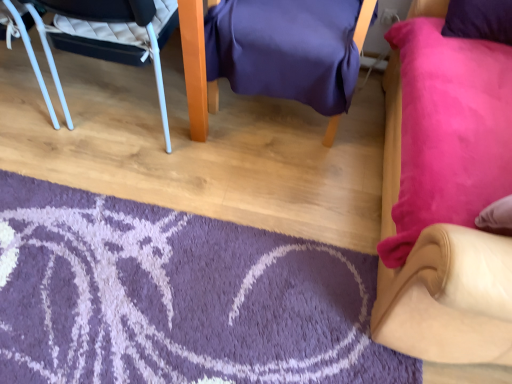
The height and width of the screenshot is (384, 512). Describe the element at coordinates (176, 297) in the screenshot. I see `purple shaggy rug at lower left` at that location.

What do you see at coordinates (196, 69) in the screenshot?
I see `purple fabric chair at center, placed as the second chair when sorted from left to right` at bounding box center [196, 69].

What are the coordinates of `suede-like beige chair at lower right, the first chair in the right-to-left sequence` in the screenshot? It's located at (449, 298).

This screenshot has height=384, width=512. I want to click on white plastic chair at left, the 1th chair in the left-to-right sequence, so click(x=119, y=22).

This screenshot has height=384, width=512. Identify the location of purple shaggy rug at lower left. (176, 297).

Is suede-like beige chair at lower right, the first chair in the right-to-left sequence, far away from purple fabric chair at center, placed as the second chair when sorted from left to right?

No, there isn't a large distance between suede-like beige chair at lower right, the first chair in the right-to-left sequence, and purple fabric chair at center, placed as the second chair when sorted from left to right.

Is suede-like beige chair at lower right, the third chair when ordered from left to right, to the right of purple fabric chair at center, which is the 2th chair in right-to-left order, from the viewer's perspective?

Indeed, suede-like beige chair at lower right, the third chair when ordered from left to right, is positioned on the right side of purple fabric chair at center, which is the 2th chair in right-to-left order.

Considering the points (391, 226) and (204, 110), which point is in front, point (391, 226) or point (204, 110)?

Point (391, 226)

Would you say suede-like beige chair at lower right, the third chair when ordered from left to right, is inside or outside purple fabric chair at center, placed as the second chair when sorted from left to right?

suede-like beige chair at lower right, the third chair when ordered from left to right, exists outside the volume of purple fabric chair at center, placed as the second chair when sorted from left to right.

How different are the orientations of white plastic chair at left, the 1th chair in the left-to-right sequence, and purple shaggy rug at lower left in degrees?

The angle between the facing direction of white plastic chair at left, the 1th chair in the left-to-right sequence, and the facing direction of purple shaggy rug at lower left is 0.279 degrees.

Is white plastic chair at left, which is the 3th chair in right-to-left order, facing towards purple shaggy rug at lower left?

No, white plastic chair at left, which is the 3th chair in right-to-left order, is not turned towards purple shaggy rug at lower left.

Can you confirm if white plastic chair at left, which is the 3th chair in right-to-left order, is positioned to the left of purple shaggy rug at lower left?

Yes.

Does white plastic chair at left, the 1th chair in the left-to-right sequence, have a smaller size compared to purple shaggy rug at lower left?

No.

Is purple shaggy rug at lower left next to white plastic chair at left, the 1th chair in the left-to-right sequence, and touching it?

No, purple shaggy rug at lower left is not beside white plastic chair at left, the 1th chair in the left-to-right sequence.

Between purple shaggy rug at lower left and white plastic chair at left, which is the 3th chair in right-to-left order, which one has smaller width?

white plastic chair at left, which is the 3th chair in right-to-left order.

Measure the distance from purple shaggy rug at lower left to white plastic chair at left, which is the 3th chair in right-to-left order.

A distance of 30.45 inches exists between purple shaggy rug at lower left and white plastic chair at left, which is the 3th chair in right-to-left order.

From the image's perspective, which is below, purple shaggy rug at lower left or white plastic chair at left, which is the 3th chair in right-to-left order?

From the image's view, purple shaggy rug at lower left is below.

Image resolution: width=512 pixels, height=384 pixels. I want to click on chair that appears in front of the white plastic chair at left, the 1th chair in the left-to-right sequence, so click(449, 298).

Is suede-like beige chair at lower right, the first chair in the right-to-left sequence, positioned far away from white plastic chair at left, which is the 3th chair in right-to-left order?

Yes, suede-like beige chair at lower right, the first chair in the right-to-left sequence, is far from white plastic chair at left, which is the 3th chair in right-to-left order.

Between suede-like beige chair at lower right, the first chair in the right-to-left sequence, and white plastic chair at left, which is the 3th chair in right-to-left order, which one is positioned behind?

white plastic chair at left, which is the 3th chair in right-to-left order, is further away from the camera.

Is suede-like beige chair at lower right, the first chair in the right-to-left sequence, taller than white plastic chair at left, the 1th chair in the left-to-right sequence?

Yes, suede-like beige chair at lower right, the first chair in the right-to-left sequence, is taller than white plastic chair at left, the 1th chair in the left-to-right sequence.

Based on the photo, is purple fabric chair at center, which is the 2th chair in right-to-left order, taller than suede-like beige chair at lower right, the first chair in the right-to-left sequence?

No, purple fabric chair at center, which is the 2th chair in right-to-left order, is not taller than suede-like beige chair at lower right, the first chair in the right-to-left sequence.

How different are the orientations of purple fabric chair at center, placed as the second chair when sorted from left to right, and suede-like beige chair at lower right, the first chair in the right-to-left sequence, in degrees?

The facing directions of purple fabric chair at center, placed as the second chair when sorted from left to right, and suede-like beige chair at lower right, the first chair in the right-to-left sequence, are 80.7 degrees apart.

Which object is more forward, purple fabric chair at center, which is the 2th chair in right-to-left order, or suede-like beige chair at lower right, the first chair in the right-to-left sequence?

suede-like beige chair at lower right, the first chair in the right-to-left sequence, is more forward.

Is purple fabric chair at center, placed as the second chair when sorted from left to right, touching suede-like beige chair at lower right, the first chair in the right-to-left sequence?

purple fabric chair at center, placed as the second chair when sorted from left to right, and suede-like beige chair at lower right, the first chair in the right-to-left sequence, are not in contact.

Could purple shaggy rug at lower left be considered to be inside suede-like beige chair at lower right, the third chair when ordered from left to right?

Definitely not — purple shaggy rug at lower left is not inside suede-like beige chair at lower right, the third chair when ordered from left to right.

How much distance is there between suede-like beige chair at lower right, the third chair when ordered from left to right, and purple shaggy rug at lower left?

20.70 inches.

Between suede-like beige chair at lower right, the first chair in the right-to-left sequence, and purple shaggy rug at lower left, which one has smaller width?

With smaller width is purple shaggy rug at lower left.

From a real-world perspective, is suede-like beige chair at lower right, the first chair in the right-to-left sequence, physically located above or below purple shaggy rug at lower left?

Clearly, from a real-world perspective, suede-like beige chair at lower right, the first chair in the right-to-left sequence, is above purple shaggy rug at lower left.

The width and height of the screenshot is (512, 384). In order to click on chair in front of the purple shaggy rug at lower left in this screenshot , I will do `click(449, 298)`.

Is point (222, 354) more distant than point (478, 352)?

Yes, it is behind point (478, 352).

Is purple shaggy rug at lower left inside the boundaries of suede-like beige chair at lower right, the third chair when ordered from left to right, or outside?

purple shaggy rug at lower left is located beyond the bounds of suede-like beige chair at lower right, the third chair when ordered from left to right.

Consider the image. Does purple shaggy rug at lower left appear on the left side of suede-like beige chair at lower right, the first chair in the right-to-left sequence?

Indeed, purple shaggy rug at lower left is positioned on the left side of suede-like beige chair at lower right, the first chair in the right-to-left sequence.

At what (x,y) coordinates should I click in order to perform the action: click on the 2nd chair behind the suede-like beige chair at lower right, the first chair in the right-to-left sequence. Please return your answer as a coordinate pair (x, y). This screenshot has height=384, width=512. Looking at the image, I should click on (196, 69).

In order to click on chair that is on the left side of purple shaggy rug at lower left in this screenshot , I will do `click(119, 22)`.

Estimate the real-world distances between objects in this image. Which object is further from suede-like beige chair at lower right, the third chair when ordered from left to right, purple fabric chair at center, which is the 2th chair in right-to-left order, or white plastic chair at left, which is the 3th chair in right-to-left order?

Among the two, white plastic chair at left, which is the 3th chair in right-to-left order, is located further to suede-like beige chair at lower right, the third chair when ordered from left to right.

Estimate the real-world distances between objects in this image. Which object is further from white plastic chair at left, the 1th chair in the left-to-right sequence, purple shaggy rug at lower left or purple fabric chair at center, placed as the second chair when sorted from left to right?

Among the two, purple shaggy rug at lower left is located further to white plastic chair at left, the 1th chair in the left-to-right sequence.

From the image, which object appears to be farther from purple fabric chair at center, which is the 2th chair in right-to-left order, suede-like beige chair at lower right, the first chair in the right-to-left sequence, or white plastic chair at left, which is the 3th chair in right-to-left order?

suede-like beige chair at lower right, the first chair in the right-to-left sequence, is positioned further to the anchor purple fabric chair at center, which is the 2th chair in right-to-left order.

Considering their positions, is white plastic chair at left, which is the 3th chair in right-to-left order, positioned closer to purple shaggy rug at lower left than suede-like beige chair at lower right, the first chair in the right-to-left sequence?

suede-like beige chair at lower right, the first chair in the right-to-left sequence, is positioned closer to the anchor purple shaggy rug at lower left.

When comparing their distances from suede-like beige chair at lower right, the third chair when ordered from left to right, does purple shaggy rug at lower left or white plastic chair at left, the 1th chair in the left-to-right sequence, seem further?

Based on the image, white plastic chair at left, the 1th chair in the left-to-right sequence, appears to be further to suede-like beige chair at lower right, the third chair when ordered from left to right.

Estimate the real-world distances between objects in this image. Which object is further from suede-like beige chair at lower right, the first chair in the right-to-left sequence, purple fabric chair at center, placed as the second chair when sorted from left to right, or purple shaggy rug at lower left?

purple fabric chair at center, placed as the second chair when sorted from left to right.

Considering their positions, is white plastic chair at left, the 1th chair in the left-to-right sequence, positioned closer to purple shaggy rug at lower left than purple fabric chair at center, which is the 2th chair in right-to-left order?

The object closer to purple shaggy rug at lower left is purple fabric chair at center, which is the 2th chair in right-to-left order.

When comparing their distances from white plastic chair at left, which is the 3th chair in right-to-left order, does purple fabric chair at center, placed as the second chair when sorted from left to right, or suede-like beige chair at lower right, the third chair when ordered from left to right, seem further?

Among the two, suede-like beige chair at lower right, the third chair when ordered from left to right, is located further to white plastic chair at left, which is the 3th chair in right-to-left order.

Image resolution: width=512 pixels, height=384 pixels. I want to click on mat between white plastic chair at left, which is the 3th chair in right-to-left order, and suede-like beige chair at lower right, the third chair when ordered from left to right, so click(176, 297).

Where is `chair located between purple shaggy rug at lower left and suede-like beige chair at lower right, the first chair in the right-to-left sequence, in the left-right direction`? This screenshot has width=512, height=384. chair located between purple shaggy rug at lower left and suede-like beige chair at lower right, the first chair in the right-to-left sequence, in the left-right direction is located at coordinates point(196,69).

You are a GUI agent. You are given a task and a screenshot of the screen. Output one action in this format:
    pyautogui.click(x=<x>, y=<y>)
    Task: Click on the chair between white plastic chair at left, which is the 3th chair in right-to-left order, and suede-like beige chair at lower right, the third chair when ordered from left to right, in the horizontal direction
    The image size is (512, 384).
    Given the screenshot: What is the action you would take?
    pyautogui.click(x=196, y=69)